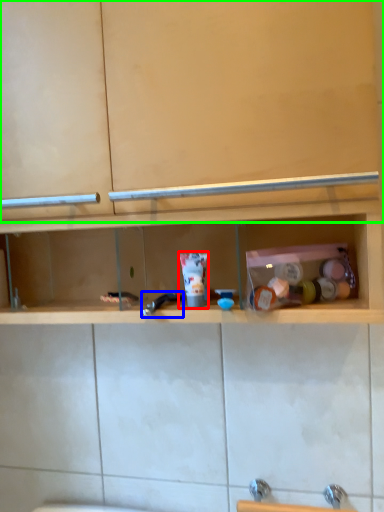
Question: Considering the real-world distances, which object is farthest from toiletry (highlighted by a red box)? faucet (highlighted by a blue box) or cabinet (highlighted by a green box)?

Choices:
 (A) faucet
 (B) cabinet

Answer: (B)